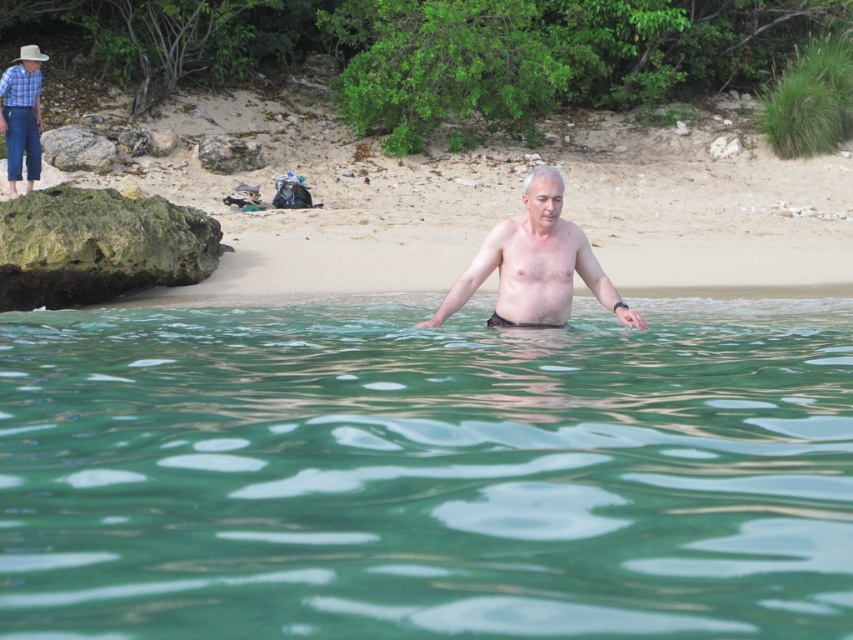
Question: Estimate the real-world distances between objects in this image. Which object is farther from the checkered fabric shirt at upper left?

Choices:
 (A) rusty metallic rock at upper center
 (B) sandy beach at center
 (C) green mossy rock at left
 (D) green translucent water at center

Answer: (D)

Question: Does green translucent water at center appear on the right side of rusty metallic rock at upper center?

Choices:
 (A) yes
 (B) no

Answer: (A)

Question: Which object is closer to the camera taking this photo?

Choices:
 (A) rusty metallic rock at upper center
 (B) skinny black shorts at center

Answer: (B)

Question: Which of the following is the closest to the observer?

Choices:
 (A) coord(9,157)
 (B) coord(531,305)

Answer: (B)

Question: Can you confirm if green mossy rock at left is smaller than checkered fabric shirt at upper left?

Choices:
 (A) yes
 (B) no

Answer: (B)

Question: Does green mossy rock at left appear on the right side of skinny black shorts at center?

Choices:
 (A) yes
 (B) no

Answer: (B)